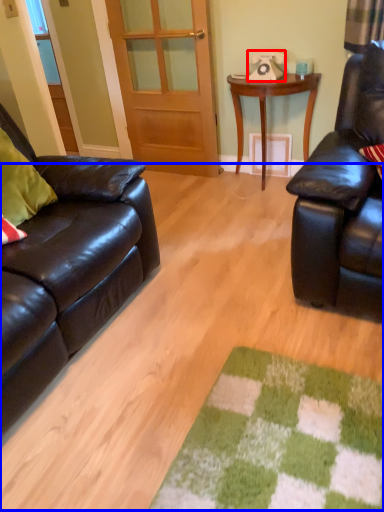
Question: Which object appears closest to the camera in this image, corded phone (highlighted by a red box) or plain (highlighted by a blue box)?

Choices:
 (A) corded phone
 (B) plain

Answer: (B)